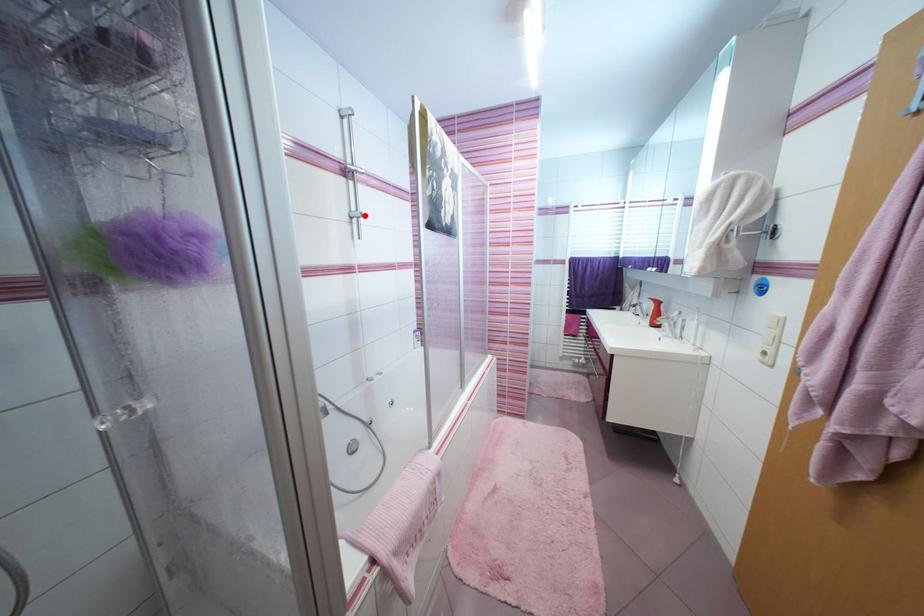
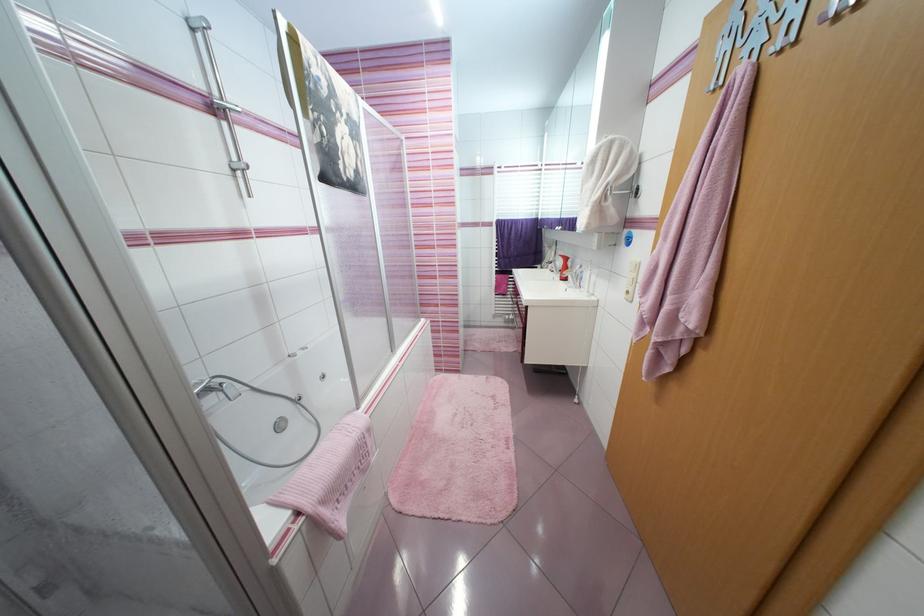
Where in the second image is the point corresponding to the highlighted location from the first image?

(249, 167)